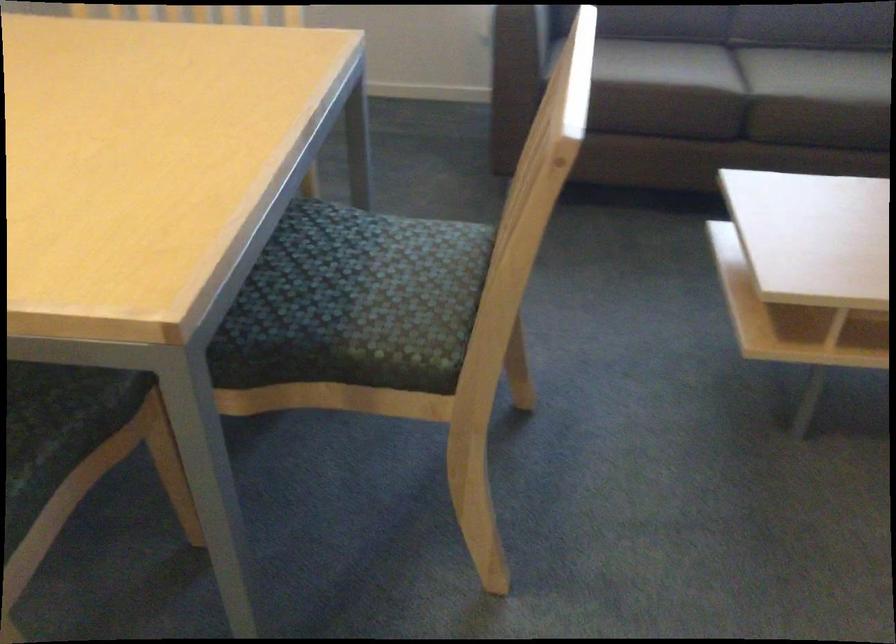
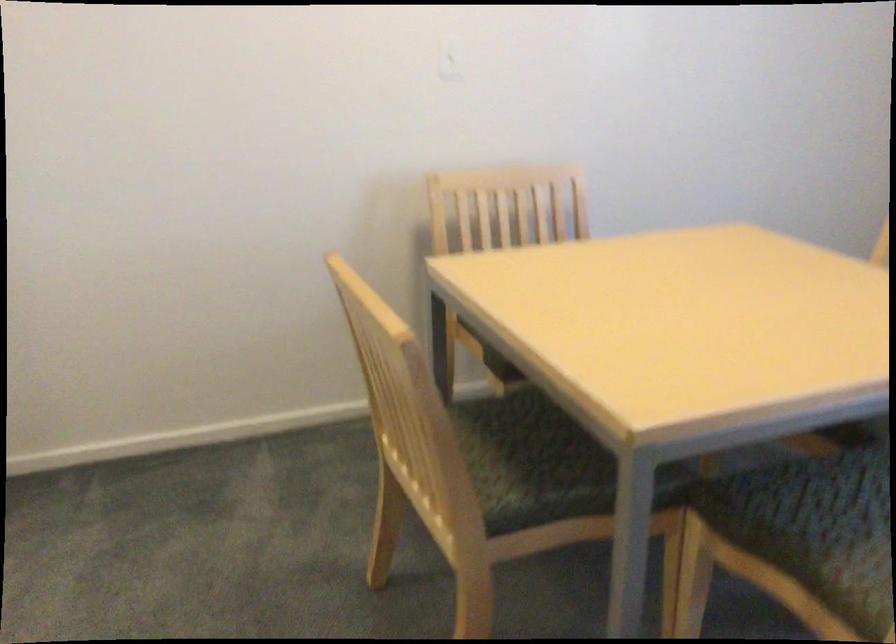
In the second image, find the point that corresponds to the point at 316,334 in the first image.

(798, 541)